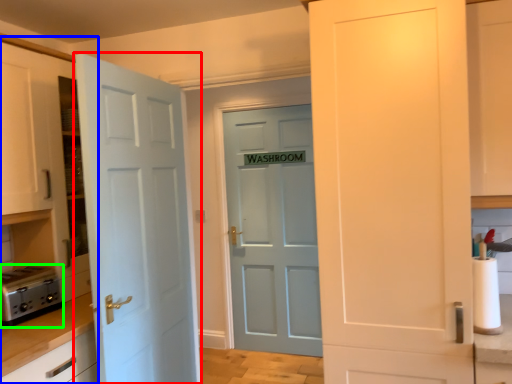
Question: Which object is positioned farthest from door (highlighted by a red box)? Select from dresser (highlighted by a blue box) and appliance (highlighted by a green box).

Choices:
 (A) dresser
 (B) appliance

Answer: (B)